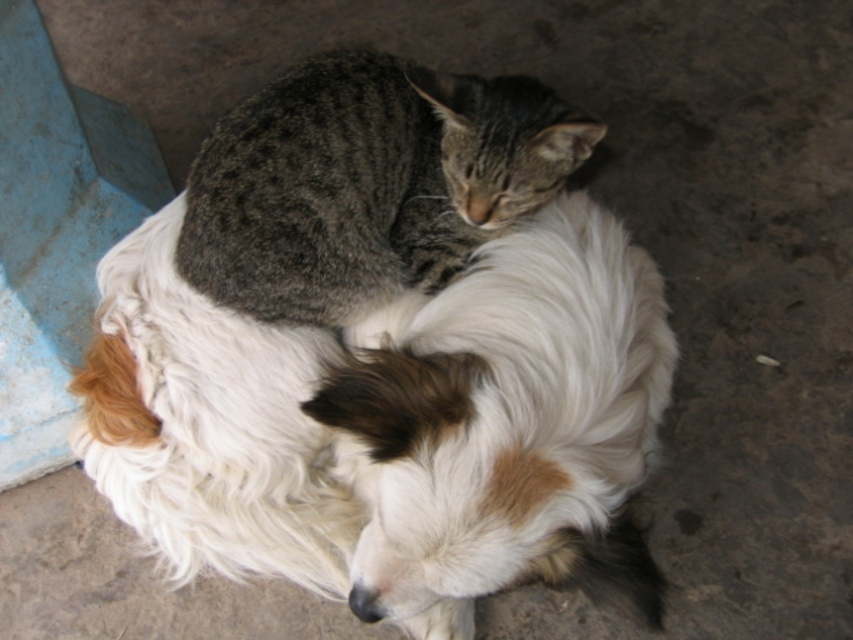
Which of these two, white fluffy dog at center or gray tabby cat at center, stands taller?

With more height is white fluffy dog at center.

Can you confirm if white fluffy dog at center is wider than gray tabby cat at center?

Yes, white fluffy dog at center is wider than gray tabby cat at center.

Image resolution: width=853 pixels, height=640 pixels. What do you see at coordinates (390, 424) in the screenshot?
I see `white fluffy dog at center` at bounding box center [390, 424].

At what (x,y) coordinates should I click in order to perform the action: click on white fluffy dog at center. Please return your answer as a coordinate pair (x, y). The width and height of the screenshot is (853, 640). Looking at the image, I should click on (390, 424).